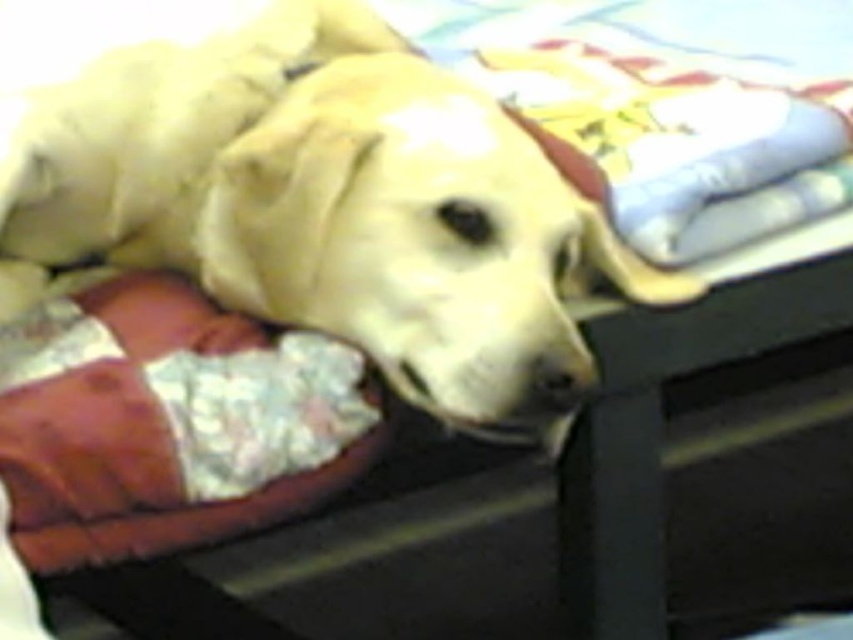
Which of these two, yellow fur dog at center or velvet-like brown dog bed at lower left, stands shorter?

With less height is velvet-like brown dog bed at lower left.

Image resolution: width=853 pixels, height=640 pixels. In order to click on yellow fur dog at center in this screenshot , I will do `click(328, 205)`.